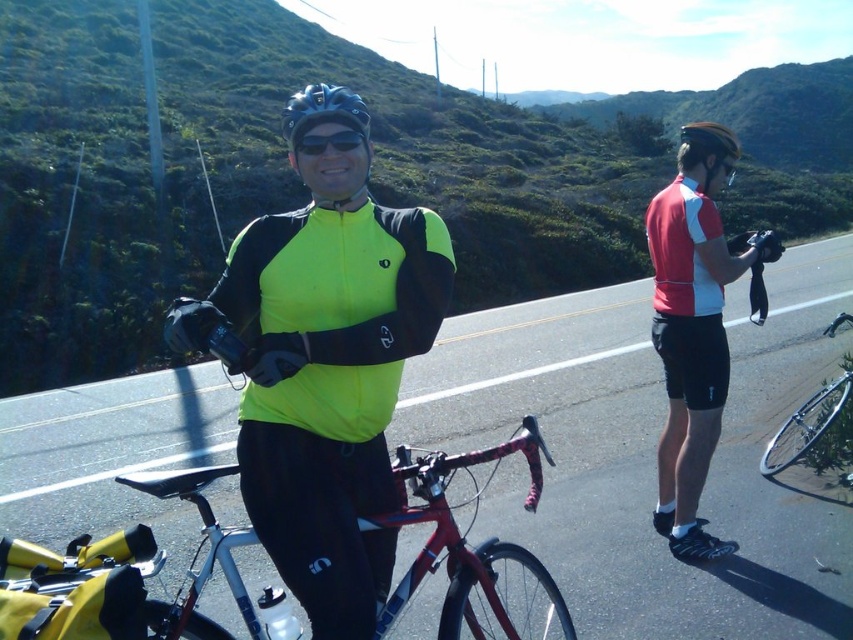
Between shiny red bicycle at center and black matte sunglasses at center, which one has less height?

Standing shorter between the two is black matte sunglasses at center.

Can you confirm if shiny red bicycle at center is positioned above black matte sunglasses at center?

No.

You are a GUI agent. You are given a task and a screenshot of the screen. Output one action in this format:
    pyautogui.click(x=<x>, y=<y>)
    Task: Click on the shiny red bicycle at center
    This screenshot has height=640, width=853.
    Given the screenshot: What is the action you would take?
    pyautogui.click(x=465, y=540)

Where is `asphalt road at center`? Image resolution: width=853 pixels, height=640 pixels. asphalt road at center is located at coordinates (648, 452).

Who is positioned more to the right, asphalt road at center or black matte helmet at center?

Positioned to the right is asphalt road at center.

Find the location of a particular element. This screenshot has height=640, width=853. asphalt road at center is located at coordinates (648, 452).

You are a GUI agent. You are given a task and a screenshot of the screen. Output one action in this format:
    pyautogui.click(x=<x>, y=<y>)
    Task: Click on the asphalt road at center
    This screenshot has height=640, width=853.
    Given the screenshot: What is the action you would take?
    pyautogui.click(x=648, y=452)

Does shiny silver bicycle at lower right lie in front of black matte helmet at center?

That is False.

Between shiny silver bicycle at lower right and black matte helmet at center, which one is positioned higher?

black matte helmet at center is higher up.

Measure the distance between point (848, 371) and camera.

Point (848, 371) and camera are 5.36 meters apart.

At what (x,y) coordinates should I click in order to perform the action: click on shiny silver bicycle at lower right. Please return your answer as a coordinate pair (x, y). Looking at the image, I should click on (805, 426).